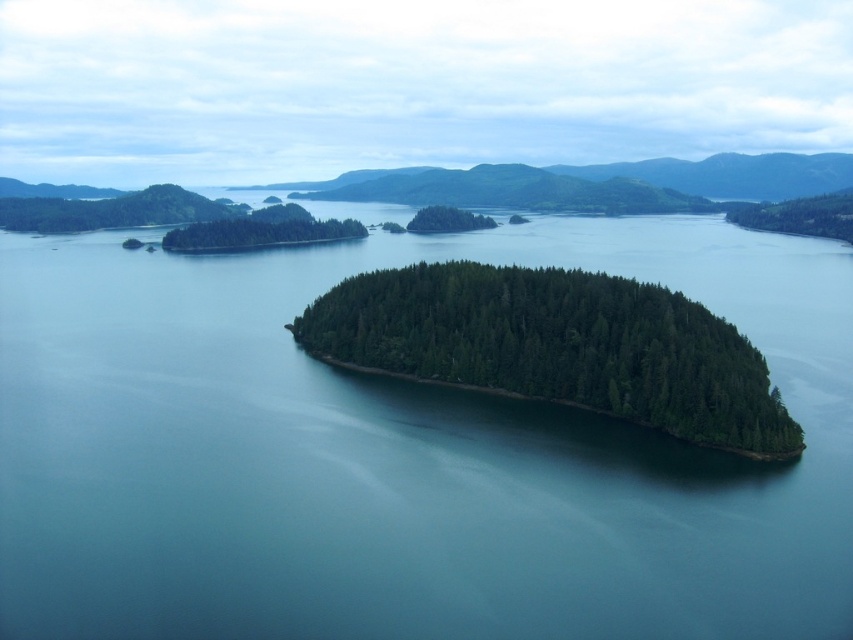
Measure the distance from greenish-blue water at center to green matte island at center.

They are 40.22 meters apart.

Is point (604, 586) closer to camera compared to point (547, 326)?

Yes, it is in front of point (547, 326).

Locate an element on the screen. This screenshot has width=853, height=640. greenish-blue water at center is located at coordinates (401, 456).

Is green matte tree at upper left further to camera compared to green matte tree at center?

That is False.

Does green matte tree at upper left have a smaller size compared to green matte tree at center?

Incorrect, green matte tree at upper left is not smaller in size than green matte tree at center.

The width and height of the screenshot is (853, 640). What do you see at coordinates (257, 234) in the screenshot?
I see `green matte tree at upper left` at bounding box center [257, 234].

Image resolution: width=853 pixels, height=640 pixels. Identify the location of green matte tree at upper left. (257, 234).

Which is below, green matte tree at upper left or green matte forest at right?

green matte tree at upper left is below.

Is green matte tree at upper left above green matte forest at right?

Incorrect, green matte tree at upper left is not positioned above green matte forest at right.

Locate an element on the screen. This screenshot has height=640, width=853. green matte tree at upper left is located at coordinates (257, 234).